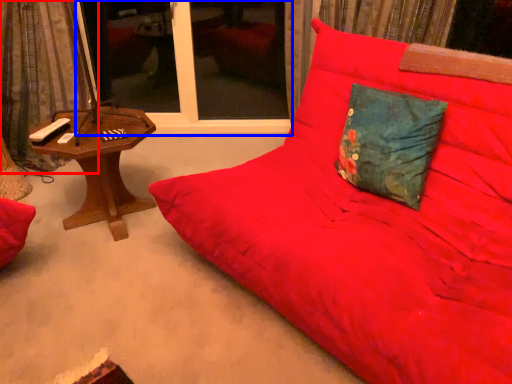
Question: Which of the following is the farthest to the observer, curtain (highlighted by a red box) or window screen (highlighted by a blue box)?

Choices:
 (A) curtain
 (B) window screen

Answer: (B)